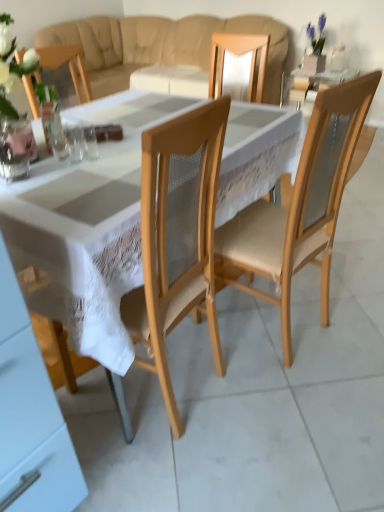
Where is `spots to the right of natural wood chair at center`? spots to the right of natural wood chair at center is located at coordinates (350, 317).